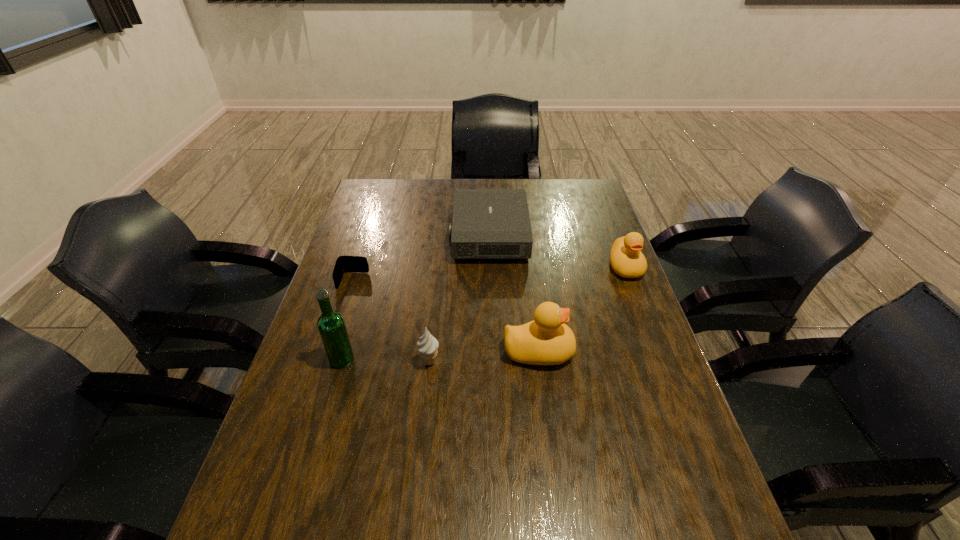
Identify the location of free space at the far edge of the desktop. 451,197.

This screenshot has width=960, height=540. Identify the location of vacant region at the near edge of the desktop. (475, 498).

Image resolution: width=960 pixels, height=540 pixels. What are the coordinates of `vacant space at the left edge` in the screenshot? It's located at (374, 220).

Locate an element on the screen. vacant space at the right edge is located at coordinates (596, 256).

Image resolution: width=960 pixels, height=540 pixels. I want to click on blank area at the far left corner, so click(x=371, y=183).

At what (x,y) coordinates should I click in order to perform the action: click on free space at the far right corner of the desktop. Please return your answer as a coordinate pair (x, y). The width and height of the screenshot is (960, 540). Looking at the image, I should click on (586, 209).

The height and width of the screenshot is (540, 960). In order to click on vacant space at the near right corner of the desktop in this screenshot , I will do `click(673, 471)`.

Where is `empty location between the nearer duck and the shorter duck`? The height and width of the screenshot is (540, 960). empty location between the nearer duck and the shorter duck is located at coordinates (582, 309).

Where is `free space between the wallet and the taller duck`? The width and height of the screenshot is (960, 540). free space between the wallet and the taller duck is located at coordinates (445, 316).

You are a GUI agent. You are given a task and a screenshot of the screen. Output one action in this format:
    pyautogui.click(x=<x>, y=<y>)
    Task: Click on the empty space that is in between the projector and the nearer duck
    The image size is (960, 540).
    Given the screenshot: What is the action you would take?
    pyautogui.click(x=514, y=293)